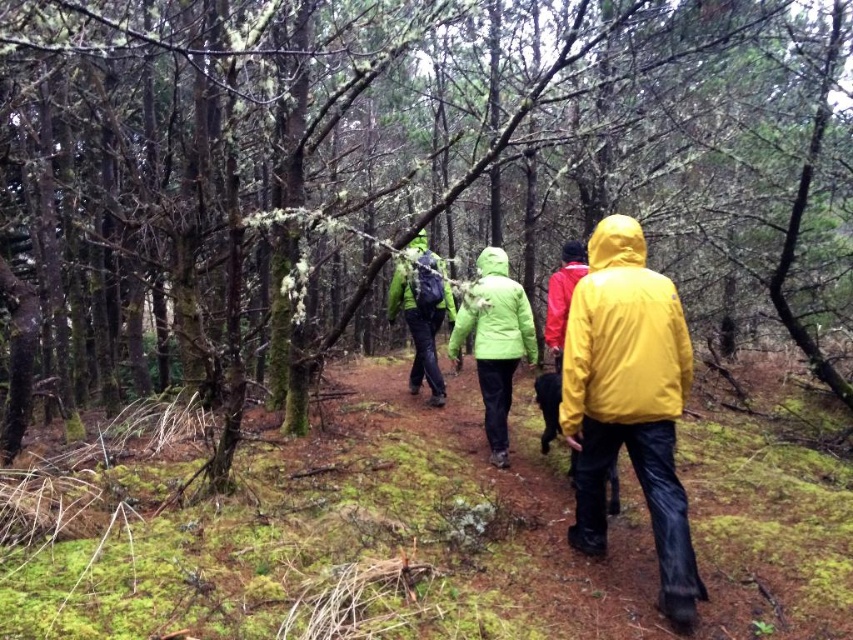
Question: Which point is farther to the camera?

Choices:
 (A) (656, 477)
 (B) (511, 291)
 (C) (436, 316)
 (D) (560, 310)

Answer: (C)

Question: Among these points, which one is nearest to the camera?

Choices:
 (A) (511, 282)
 (B) (403, 310)
 (C) (642, 403)
 (D) (576, 275)

Answer: (C)

Question: Is yellow waterproof jacket at center further to camera compared to matte green jacket at center?

Choices:
 (A) no
 (B) yes

Answer: (A)

Question: Considering the real-world distances, which object is closest to the matte green jacket at center?

Choices:
 (A) red matte jacket at center
 (B) yellow matte jacket at center
 (C) green matte jacket at center
 (D) yellow waterproof jacket at center

Answer: (C)

Question: Can you confirm if yellow matte jacket at center is positioned below matte green jacket at center?

Choices:
 (A) no
 (B) yes

Answer: (B)

Question: Can you confirm if yellow waterproof jacket at center is positioned to the right of green matte jacket at center?

Choices:
 (A) yes
 (B) no

Answer: (A)